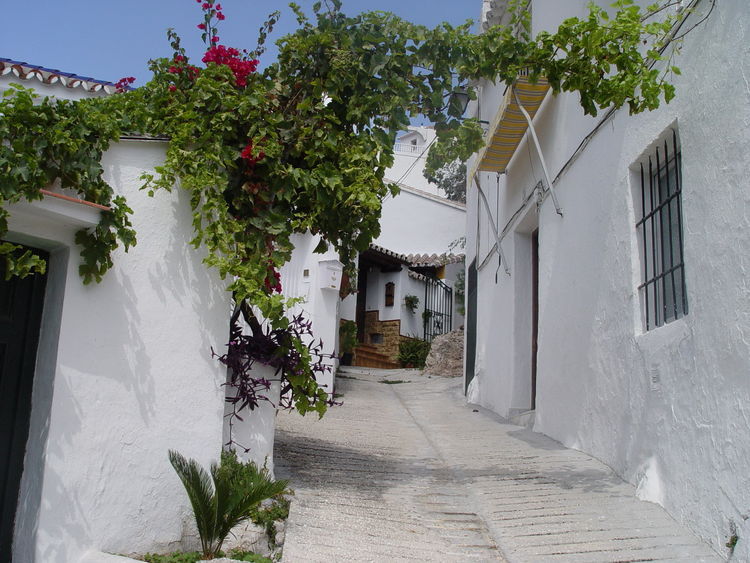
At what (x,y) coordinates should I click in order to perform the action: click on stairs. Please return your answer as a coordinate pair (x, y). Looking at the image, I should click on coord(368,354).